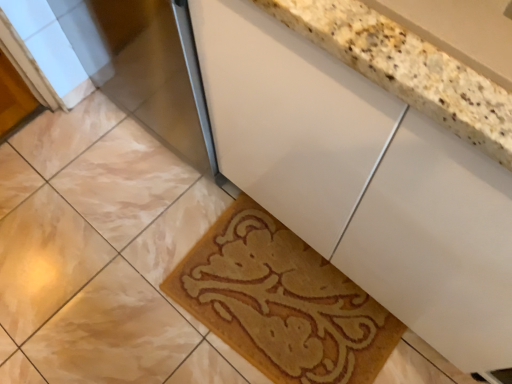
Question: Is marble tile at lower left positioned in front of white glossy cabinet at center?

Choices:
 (A) no
 (B) yes

Answer: (A)

Question: Is marble tile at lower left oriented away from white glossy cabinet at center?

Choices:
 (A) yes
 (B) no

Answer: (B)

Question: Can you confirm if marble tile at lower left is thinner than white glossy cabinet at center?

Choices:
 (A) yes
 (B) no

Answer: (A)

Question: Could white glossy cabinet at center be considered to be inside marble tile at lower left?

Choices:
 (A) yes
 (B) no

Answer: (B)

Question: Considering the relative positions of marble tile at lower left and white glossy cabinet at center in the image provided, is marble tile at lower left to the right of white glossy cabinet at center from the viewer's perspective?

Choices:
 (A) no
 (B) yes

Answer: (A)

Question: Is point (266, 165) closer or farther from the camera than point (59, 284)?

Choices:
 (A) farther
 (B) closer

Answer: (B)

Question: From their relative heights in the image, would you say white glossy cabinet at center is taller or shorter than marble tile at lower left?

Choices:
 (A) tall
 (B) short

Answer: (A)

Question: Is white glossy cabinet at center in front of or behind marble tile at lower left in the image?

Choices:
 (A) behind
 (B) front

Answer: (B)

Question: From the image's perspective, is white glossy cabinet at center above or below marble tile at lower left?

Choices:
 (A) above
 (B) below

Answer: (A)

Question: Considering the relative positions of marble tile at lower left and beige textured bath mat at lower center in the image provided, is marble tile at lower left to the left or to the right of beige textured bath mat at lower center?

Choices:
 (A) right
 (B) left

Answer: (B)

Question: From a real-world perspective, relative to beige textured bath mat at lower center, is marble tile at lower left vertically above or below?

Choices:
 (A) below
 (B) above

Answer: (A)

Question: Does point (31, 266) appear closer or farther from the camera than point (287, 266)?

Choices:
 (A) closer
 (B) farther

Answer: (B)

Question: Considering the positions of marble tile at lower left and beige textured bath mat at lower center in the image, is marble tile at lower left bigger or smaller than beige textured bath mat at lower center?

Choices:
 (A) small
 (B) big

Answer: (A)

Question: Considering the positions of marble tile at lower left and white glossy cabinet at center in the image, is marble tile at lower left bigger or smaller than white glossy cabinet at center?

Choices:
 (A) big
 (B) small

Answer: (B)

Question: From the image's perspective, is marble tile at lower left above or below white glossy cabinet at center?

Choices:
 (A) above
 (B) below

Answer: (B)